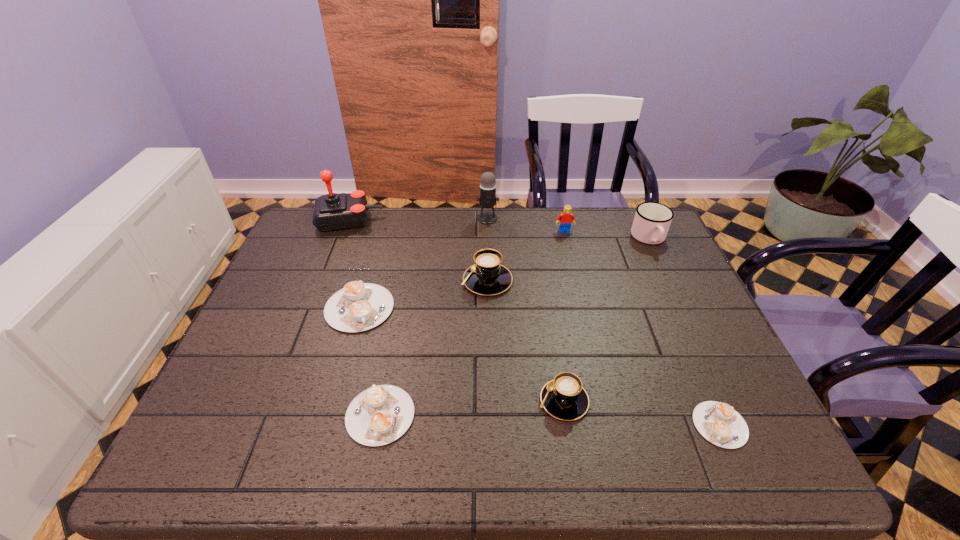
This screenshot has height=540, width=960. Identify the location of object that is the eighth nearest to the right black cappuccino. (333, 211).

Find the location of `object that is the fifth closest to the bigger black cappuccino`. object that is the fifth closest to the bigger black cappuccino is located at coordinates (379, 415).

Locate an element on the screen. The image size is (960, 540). cappuccino that stands as the closest to the red Lego is located at coordinates (487, 276).

Find the location of a particular element. The height and width of the screenshot is (540, 960). cappuccino that is the fifth closest to the mug is located at coordinates (379, 415).

Where is `white cappuccino that is the third closest to the third object from right to left`? white cappuccino that is the third closest to the third object from right to left is located at coordinates (379, 415).

I want to click on the third closest white cappuccino to the farther black cappuccino, so click(x=719, y=423).

This screenshot has height=540, width=960. I want to click on vacant area that satisfies the following two spatial constraints: 1. on the front side of the farthest white cappuccino; 2. on the left side of the joystick, so click(x=315, y=308).